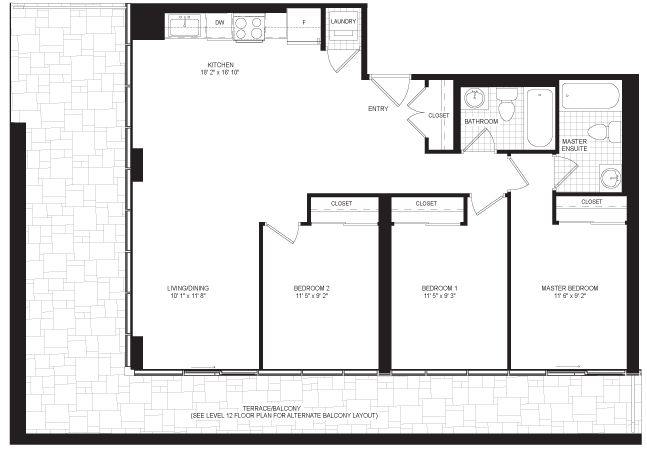
Identify the location of tubs. The width and height of the screenshot is (647, 458). (542, 115), (587, 100).